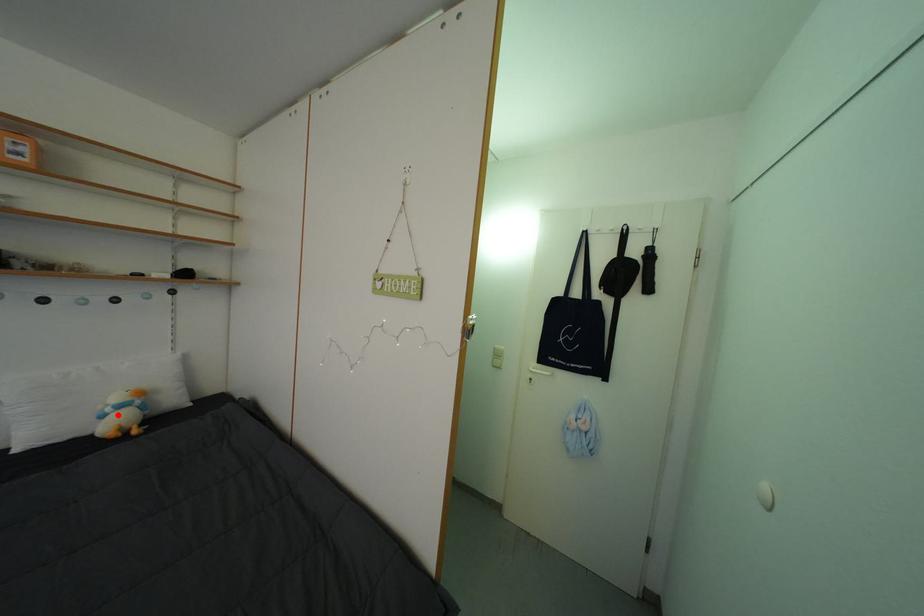
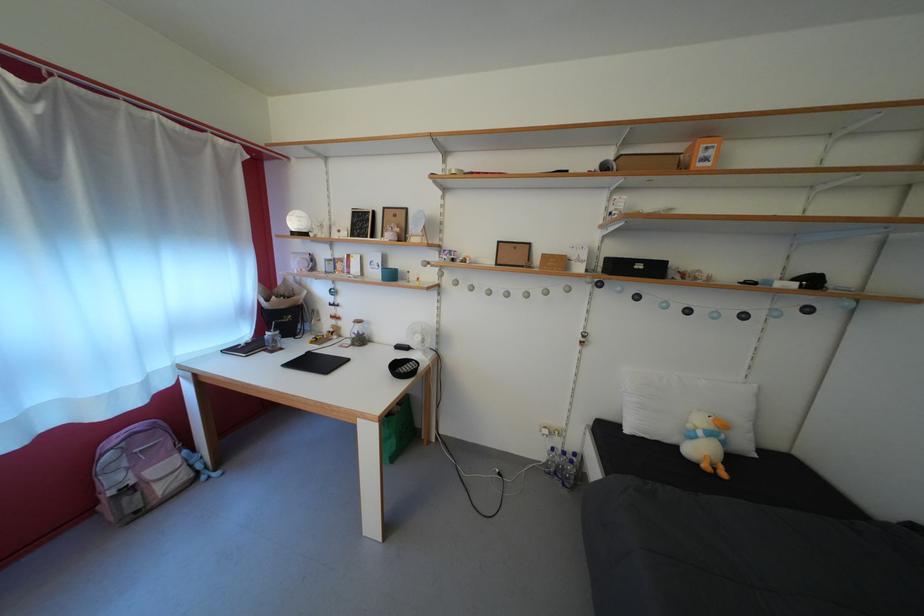
Question: I am providing you with two images of the same scene from different viewpoints. In image1, a red point is highlighted. Considering the same 3D point in image2, which of the following is correct?

Choices:
 (A) It is closer
 (B) It is farther

Answer: (B)